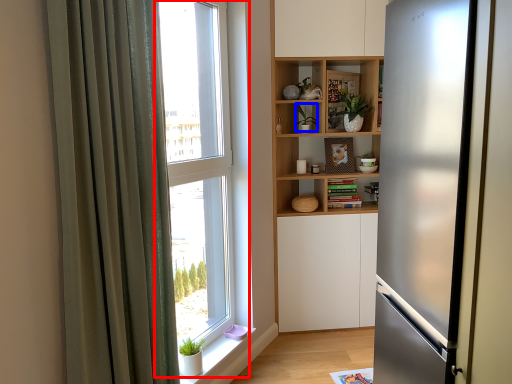
Question: Which point is further to the camera, window (highlighted by a red box) or plant (highlighted by a blue box)?

Choices:
 (A) window
 (B) plant

Answer: (B)